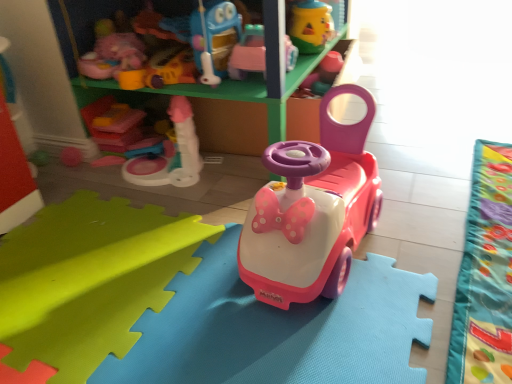
Question: From the image's perspective, is velvet green blanket at lower right over pink plastic toy car at center, the 3th toy viewed from the right?

Choices:
 (A) yes
 (B) no

Answer: (B)

Question: Is velvet green blanket at lower right next to pink plastic toy car at center, arranged as the 3th toy when viewed from the left, and touching it?

Choices:
 (A) yes
 (B) no

Answer: (B)

Question: Is velvet green blanket at lower right closer to the viewer compared to pink plastic toy car at center, the 3th toy viewed from the right?

Choices:
 (A) no
 (B) yes

Answer: (B)

Question: Is velvet green blanket at lower right looking in the opposite direction of pink plastic toy car at center, arranged as the 3th toy when viewed from the left?

Choices:
 (A) yes
 (B) no

Answer: (B)

Question: Is velvet green blanket at lower right aimed at pink plastic toy car at center, the 3th toy viewed from the right?

Choices:
 (A) yes
 (B) no

Answer: (B)

Question: From their relative heights in the image, would you say rubber duck at upper center, the 1th toy viewed from the right, is taller or shorter than matte pink plastic walker at upper center, which is the fourth toy from right to left?

Choices:
 (A) short
 (B) tall

Answer: (B)

Question: From a real-world perspective, is rubber duck at upper center, the 1th toy viewed from the right, physically located above or below matte pink plastic walker at upper center, which is the fourth toy from right to left?

Choices:
 (A) below
 (B) above

Answer: (A)

Question: Which is correct: rubber duck at upper center, the 1th toy viewed from the right, is inside matte pink plastic walker at upper center, which is the fourth toy from right to left, or outside of it?

Choices:
 (A) inside
 (B) outside

Answer: (B)

Question: In the image, is rubber duck at upper center, the fifth toy positioned from the left, positioned in front of or behind matte pink plastic walker at upper center, the second toy viewed from the left?

Choices:
 (A) front
 (B) behind

Answer: (B)

Question: From a real-world perspective, is matte pink plastic walker at upper center, the second toy viewed from the left, physically located above or below green plastic shelf at upper center?

Choices:
 (A) above
 (B) below

Answer: (A)

Question: From the image's perspective, is matte pink plastic walker at upper center, which is the fourth toy from right to left, above or below green plastic shelf at upper center?

Choices:
 (A) above
 (B) below

Answer: (B)

Question: Looking at the image, does matte pink plastic walker at upper center, which is the fourth toy from right to left, seem bigger or smaller compared to green plastic shelf at upper center?

Choices:
 (A) big
 (B) small

Answer: (B)

Question: Looking at their shapes, would you say matte pink plastic walker at upper center, the second toy viewed from the left, is wider or thinner than green plastic shelf at upper center?

Choices:
 (A) wide
 (B) thin

Answer: (B)

Question: Is point (309, 23) positioned closer to the camera than point (254, 41)?

Choices:
 (A) farther
 (B) closer

Answer: (A)

Question: Considering the positions of rubber duck at upper center, the fifth toy positioned from the left, and pink plastic toy car at center, arranged as the 3th toy when viewed from the left, in the image, is rubber duck at upper center, the fifth toy positioned from the left, bigger or smaller than pink plastic toy car at center, arranged as the 3th toy when viewed from the left,?

Choices:
 (A) big
 (B) small

Answer: (B)